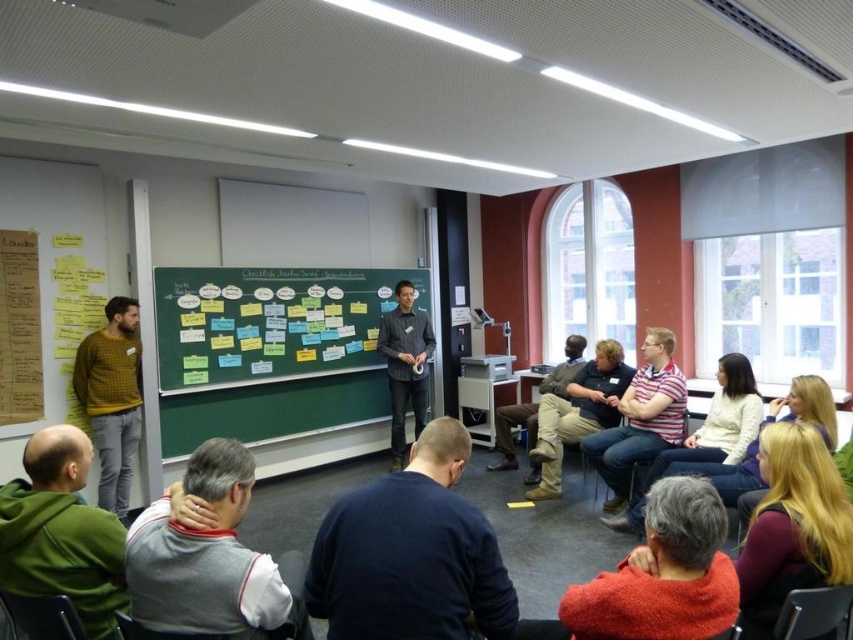
You are a participant in the meeting and you see the point at coordinates (61, 532). What object is located at that point?

The point at coordinates (61, 532) is located on the green fleece jacket at lower left.

You are an observer looking at the group meeting scene. You notice two items at the center of the image. Which item is positioned lower down between the khaki corduroy pants at center and the dark gray shirt at center?

The khaki corduroy pants at center is located below the dark gray shirt at center, so it is positioned lower down.

You are standing in the room and need to place a new sticky note on the green chalkboard at the front. However, you notice the green fleece jacket at lower left. Where is the green fleece jacket in relation to the green chalkboard?

The green fleece jacket at lower left is located at point [61,532], which is to the lower left of the green chalkboard at the front.